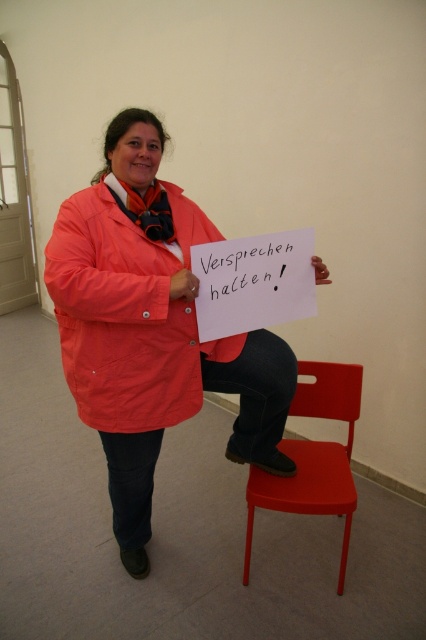
Question: Among these objects, which one is nearest to the camera?

Choices:
 (A) matte nylon jacket at center
 (B) matte plastic chair at lower center
 (C) matte orange coat at center

Answer: (C)

Question: Considering the relative positions of matte orange coat at center and matte plastic chair at lower center in the image provided, where is matte orange coat at center located with respect to matte plastic chair at lower center?

Choices:
 (A) left
 (B) right

Answer: (A)

Question: Does matte nylon jacket at center appear on the right side of matte orange coat at center?

Choices:
 (A) yes
 (B) no

Answer: (A)

Question: Among these objects, which one is nearest to the camera?

Choices:
 (A) matte plastic chair at lower center
 (B) matte orange coat at center
 (C) matte nylon jacket at center

Answer: (B)

Question: Can you confirm if matte orange coat at center is positioned below matte plastic chair at lower center?

Choices:
 (A) yes
 (B) no

Answer: (B)

Question: Which object is farther from the camera taking this photo?

Choices:
 (A) matte plastic chair at lower center
 (B) matte nylon jacket at center
 (C) matte orange coat at center

Answer: (A)